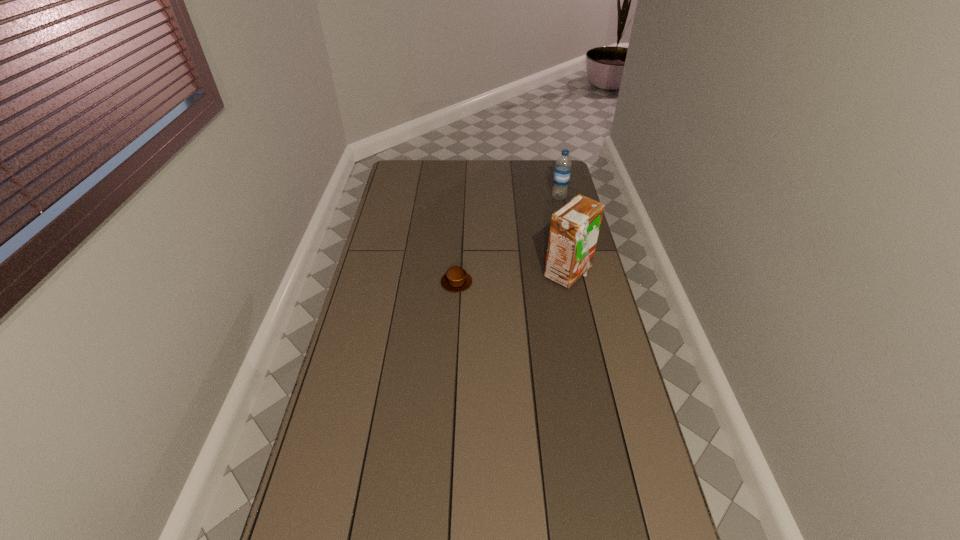
Where is `the shortest object`? the shortest object is located at coordinates point(456,279).

Locate an element on the screen. This screenshot has height=540, width=960. the leftmost object is located at coordinates [x=456, y=279].

Where is `carton`? Image resolution: width=960 pixels, height=540 pixels. carton is located at coordinates (574, 230).

The image size is (960, 540). What are the coordinates of `the farthest object` in the screenshot? It's located at (562, 170).

Find the location of a particular element. the second tallest object is located at coordinates (562, 170).

The height and width of the screenshot is (540, 960). What are the coordinates of `free space located on the left of the leftmost object` in the screenshot? It's located at (412, 282).

You are a GUI agent. You are given a task and a screenshot of the screen. Output one action in this format:
    pyautogui.click(x=<x>, y=<y>)
    Task: Click on the vacant space located on the label of the farthest object
    The width and height of the screenshot is (960, 540).
    Given the screenshot: What is the action you would take?
    pyautogui.click(x=540, y=224)

This screenshot has width=960, height=540. In order to click on vacant position located 0.260m on the label of the farthest object in this screenshot , I will do `click(536, 230)`.

You are a GUI agent. You are given a task and a screenshot of the screen. Output one action in this format:
    pyautogui.click(x=<x>, y=<y>)
    Task: Click on the free space located 0.140m on the label of the farthest object
    Image resolution: width=960 pixels, height=540 pixels.
    Given the screenshot: What is the action you would take?
    pyautogui.click(x=545, y=216)

The height and width of the screenshot is (540, 960). Identify the location of carton that is positioned at the right edge. click(x=574, y=230).